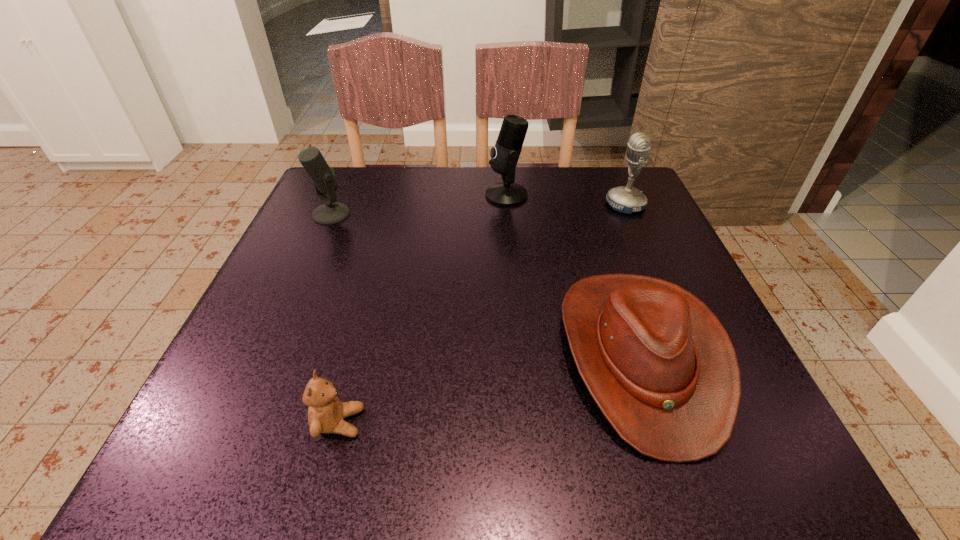
Where is `free space located 0.070m on the front-facing side of the rightmost microphone`? Image resolution: width=960 pixels, height=540 pixels. free space located 0.070m on the front-facing side of the rightmost microphone is located at coordinates click(x=576, y=205).

This screenshot has width=960, height=540. What are the coordinates of `free space located on the back of the leftmost object` in the screenshot? It's located at (344, 186).

Where is `vacant area situated 0.060m on the face of the teddy bear`? This screenshot has width=960, height=540. vacant area situated 0.060m on the face of the teddy bear is located at coordinates (404, 422).

Where is `teddy bear at the near edge`? This screenshot has width=960, height=540. teddy bear at the near edge is located at coordinates (326, 412).

Image resolution: width=960 pixels, height=540 pixels. What are the coordinates of `cowboy hat located in the near edge section of the desktop` in the screenshot? It's located at (658, 363).

Where is `object that is at the left edge`? This screenshot has width=960, height=540. object that is at the left edge is located at coordinates (325, 181).

Locate an element on the screen. microphone at the right edge is located at coordinates (626, 199).

The image size is (960, 540). What are the coordinates of `cowboy hat located at the right edge` in the screenshot? It's located at (658, 363).

Locate an element on the screen. The image size is (960, 540). object that is at the far left corner is located at coordinates (325, 181).

The image size is (960, 540). What are the coordinates of `object that is at the far right corner` in the screenshot? It's located at (626, 199).